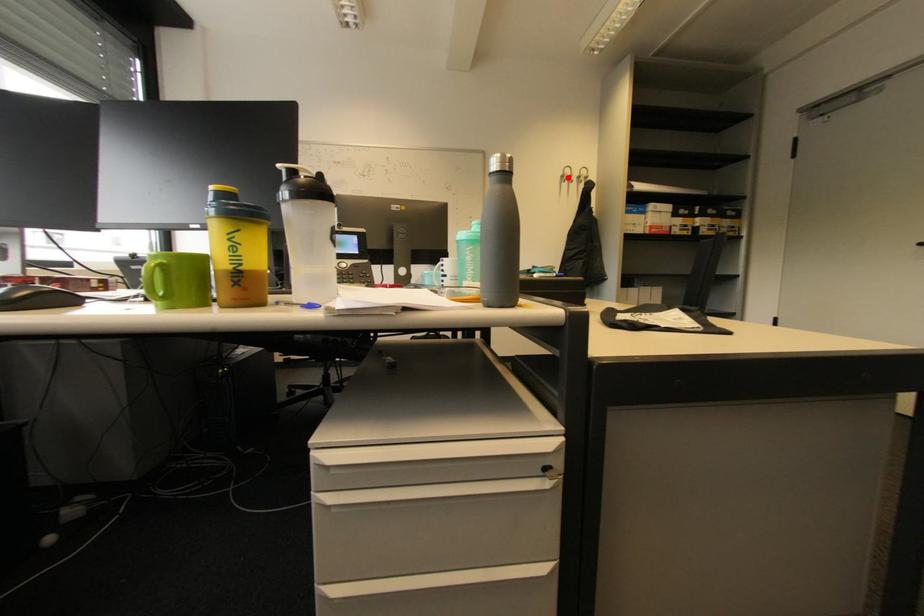
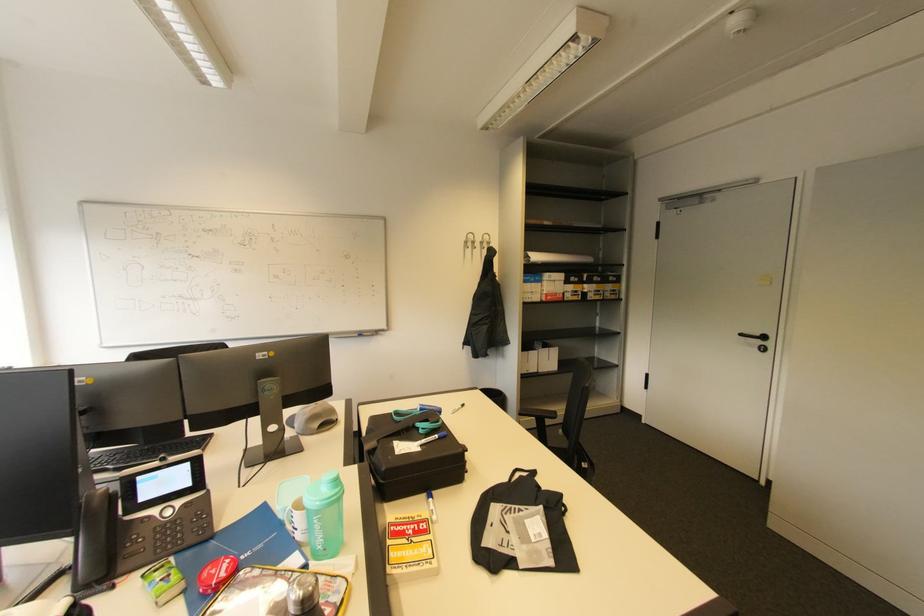
The point at the highlighted location is marked in the first image. Where is the corresponding point in the second image?

(470, 243)